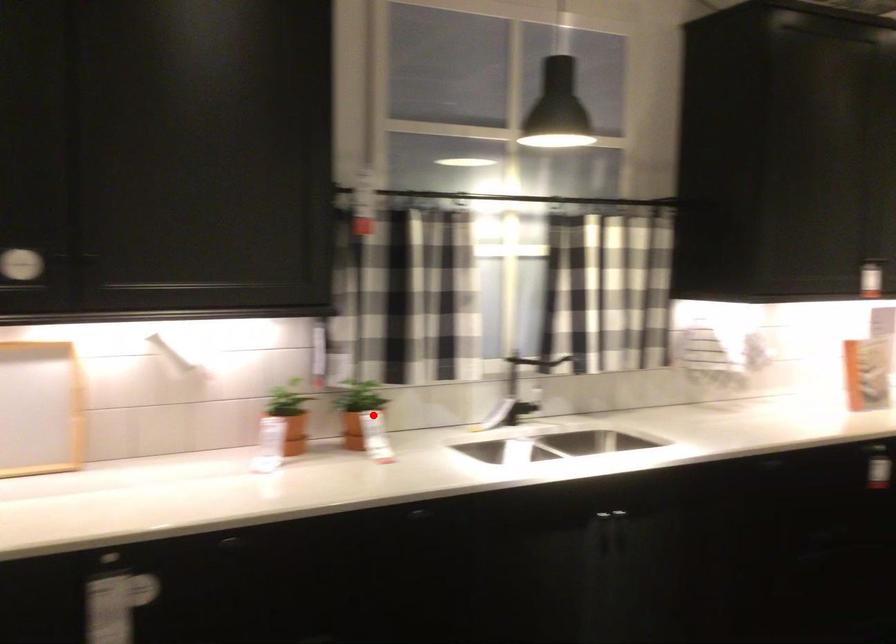
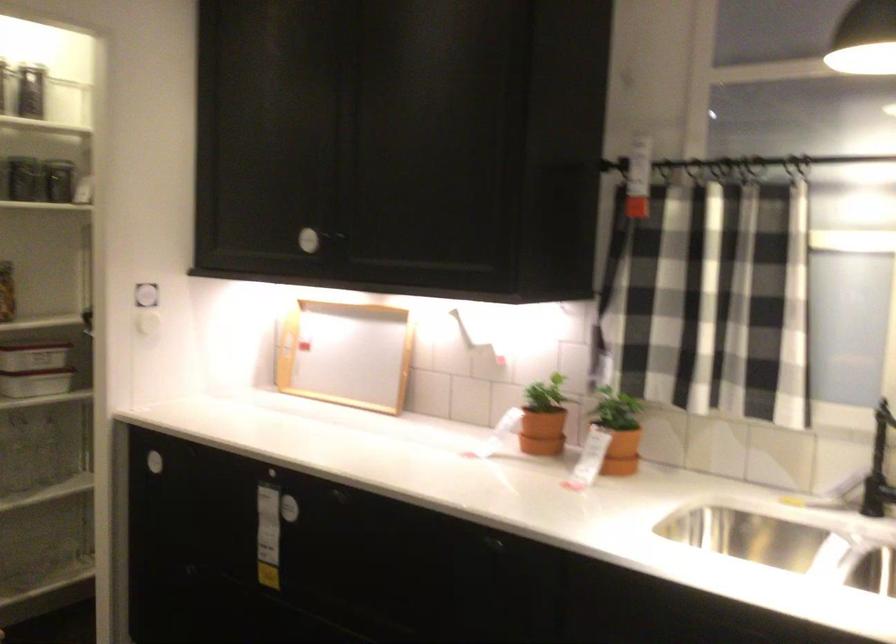
Where in the second image is the point corresponding to the highlighted location from the first image?

(617, 430)